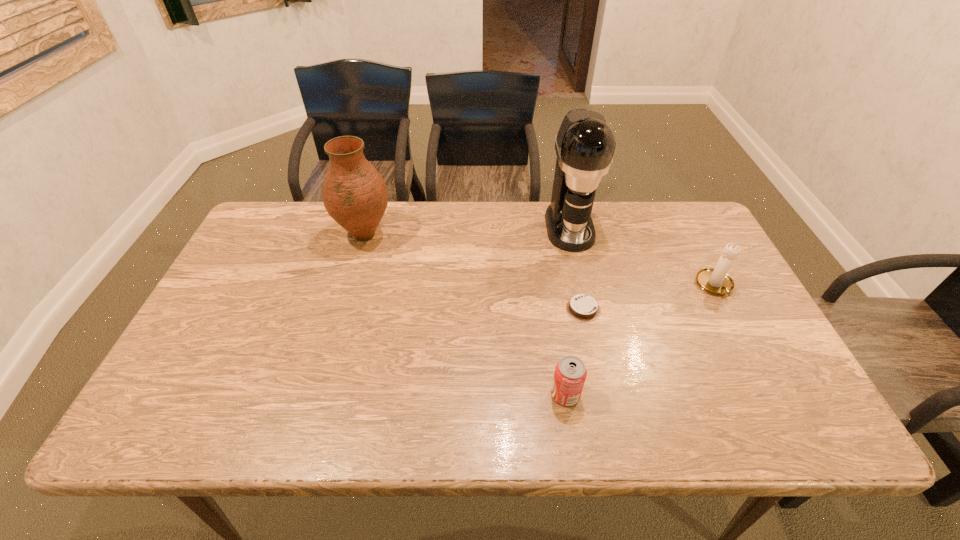
Find the location of a particular element. the tallest object is located at coordinates (585, 144).

This screenshot has width=960, height=540. What are the coordinates of `vase` in the screenshot? It's located at (354, 194).

Image resolution: width=960 pixels, height=540 pixels. Identify the location of the leftmost object. (354, 194).

You are a GUI agent. You are given a task and a screenshot of the screen. Output one action in this format:
    pyautogui.click(x=<x>, y=<y>)
    Task: Click on the rightmost object
    Image resolution: width=960 pixels, height=540 pixels.
    Given the screenshot: What is the action you would take?
    (716, 281)

Find the location of a particular element. This screenshot has width=960, height=540. candle holder is located at coordinates (716, 281).

Locate an element on the screen. soda can is located at coordinates (570, 374).

Identify the location of the nearest object. The height and width of the screenshot is (540, 960). (570, 374).

At what (x,y) coordinates should I click in order to perform the action: click on chocolate cake. Please return your answer as a coordinate pair (x, y). This screenshot has height=540, width=960. Looking at the image, I should click on (581, 307).

Where is `free space located place cup under the spout of the coffee maker`? free space located place cup under the spout of the coffee maker is located at coordinates (587, 305).

Find the location of a particular element. free space located on the front of the vase is located at coordinates point(331,352).